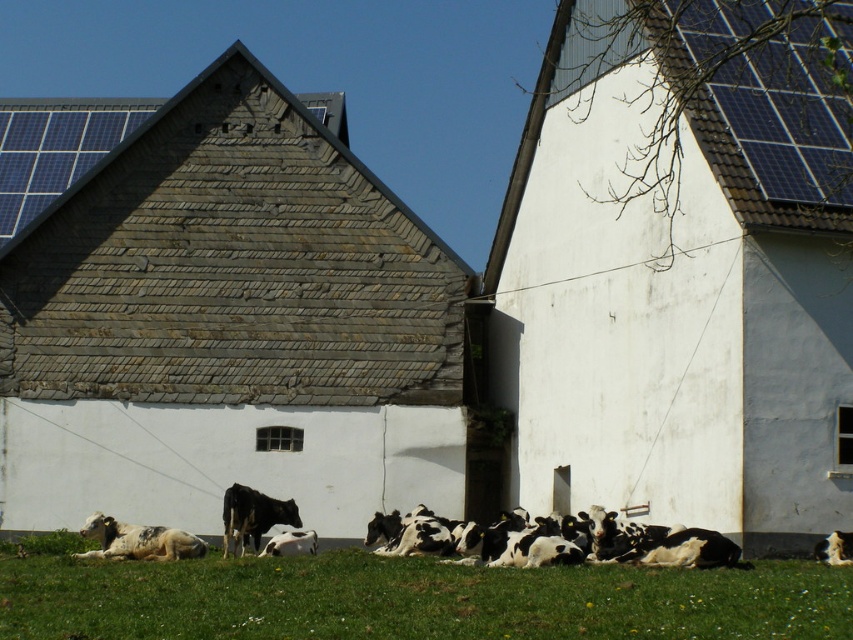
You are standing at the point marked as point (676,304) in the rural scene. Which barn are you near? The scene has a weathered barn with dark gray slate roof on the left and a modern white barn on the right. Please choose between the two.

You are near the white matte barn at lower right because the point (676,304) is located on it.